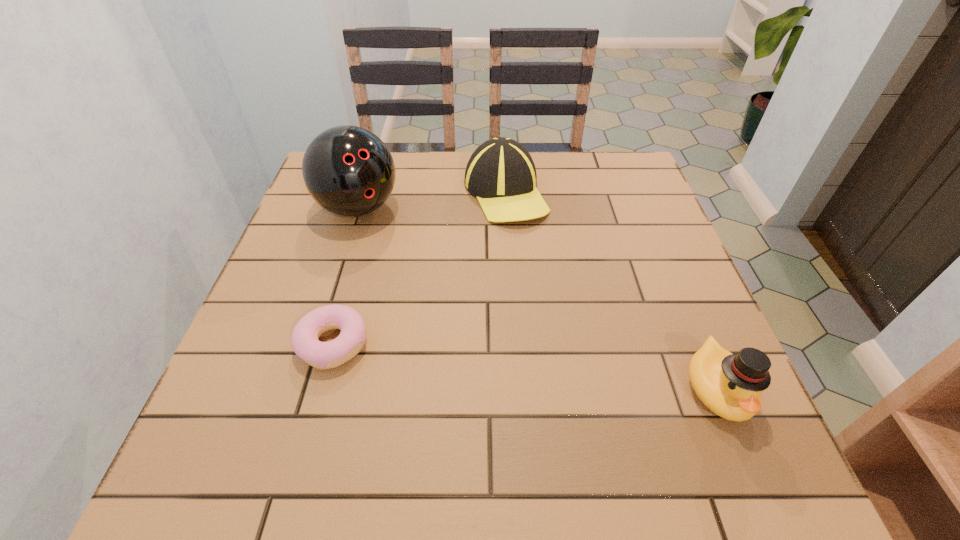
This screenshot has width=960, height=540. Find the location of `free space located on the surface of the tallest object near the finger holes`. free space located on the surface of the tallest object near the finger holes is located at coordinates (431, 294).

Image resolution: width=960 pixels, height=540 pixels. I want to click on baseball cap positioned at the far edge, so tap(501, 173).

Where is `bowling ball present at the far edge`? This screenshot has height=540, width=960. bowling ball present at the far edge is located at coordinates (349, 171).

Image resolution: width=960 pixels, height=540 pixels. Identify the location of object that is at the near edge. (730, 385).

In order to click on doughnut present at the left edge in this screenshot , I will do `click(304, 340)`.

At what (x,y) coordinates should I click in order to perform the action: click on bowling ball that is positioned at the left edge. Please return your answer as a coordinate pair (x, y). The width and height of the screenshot is (960, 540). Looking at the image, I should click on (349, 171).

At what (x,y) coordinates should I click in order to perform the action: click on object that is at the right edge. Please return your answer as a coordinate pair (x, y). Looking at the image, I should click on (730, 385).

This screenshot has width=960, height=540. What are the coordinates of `object that is at the far left corner` in the screenshot? It's located at (349, 171).

Where is `object present at the near right corner`? The height and width of the screenshot is (540, 960). object present at the near right corner is located at coordinates (730, 385).

Identify the location of free spot at the far edge of the desktop. (399, 161).